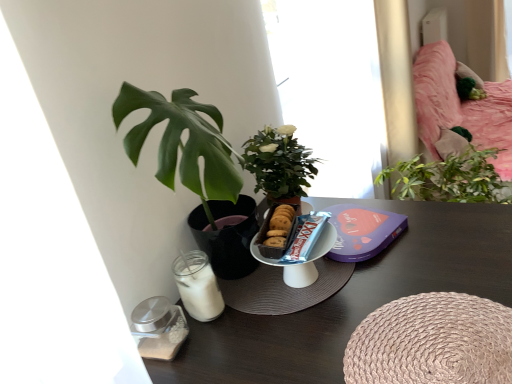
Locate an element on the screen. This screenshot has height=384, width=512. free point above woven beige placemat at lower right (from a real-world perspective) is located at coordinates (434, 340).